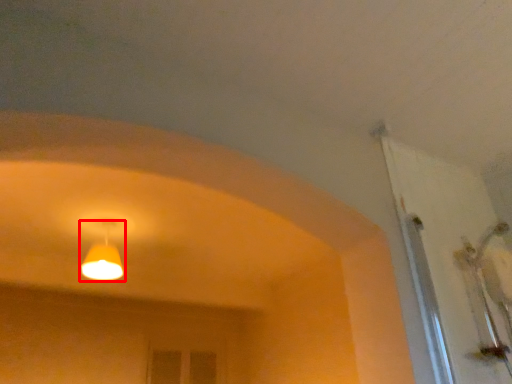
Question: Observing the image, what is the correct spatial positioning of lamp (annotated by the red box) in reference to door?

Choices:
 (A) right
 (B) left

Answer: (B)